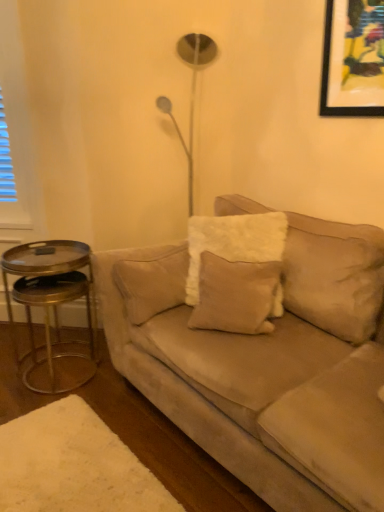
In order to face suede beige couch at center, should I rotate leftwards or rightwards?

A 9.845 degree turn to the right will do.

Locate an element on the screen. suede beige couch at center is located at coordinates (267, 366).

Does gold metallic side table at left lie in front of beige velvet pillow at center?

No, the depth of gold metallic side table at left is greater than that of beige velvet pillow at center.

Is gold metallic side table at left located outside beige velvet pillow at center?

Yes, gold metallic side table at left is outside of beige velvet pillow at center.

From the image's perspective, is gold metallic side table at left below beige velvet pillow at center?

Yes, from the image's perspective, gold metallic side table at left is below beige velvet pillow at center.

From a real-world perspective, is beige velvet pillow at center physically located above or below suede beige couch at center?

In terms of real-world spatial position, beige velvet pillow at center is above suede beige couch at center.

Is beige velvet pillow at center far from suede beige couch at center?

beige velvet pillow at center is near suede beige couch at center, not far away.

Looking at the image, does beige velvet pillow at center seem bigger or smaller compared to suede beige couch at center?

In the image, beige velvet pillow at center appears to be smaller than suede beige couch at center.

Considering the relative positions of beige velvet pillow at center and suede beige couch at center in the image provided, is beige velvet pillow at center to the left of suede beige couch at center from the viewer's perspective?

Yes, beige velvet pillow at center is to the left of suede beige couch at center.

Based on the photo, does beige velvet pillow at center have a lesser width compared to gold metallic side table at left?

Indeed, beige velvet pillow at center has a lesser width compared to gold metallic side table at left.

How much distance is there between beige velvet pillow at center and gold metallic side table at left?

beige velvet pillow at center is 33.95 inches away from gold metallic side table at left.

Is beige velvet pillow at center to the left of gold metallic side table at left from the viewer's perspective?

Incorrect, beige velvet pillow at center is not on the left side of gold metallic side table at left.

Does point (253, 265) appear closer or farther from the camera than point (32, 347)?

Point (253, 265).

Consider the image. Could you tell me if suede beige couch at center is facing gold metallic side table at left?

No, suede beige couch at center is not facing towards gold metallic side table at left.

Is suede beige couch at center far from gold metallic side table at left?

No, suede beige couch at center is not far away from gold metallic side table at left.

Looking at this image, looking at the image, does suede beige couch at center seem bigger or smaller compared to gold metallic side table at left?

Considering their sizes, suede beige couch at center takes up more space than gold metallic side table at left.

Locate an element on the screen. table that appears on the left of suede beige couch at center is located at coordinates (52, 307).

Which object is further away from the camera taking this photo, suede beige couch at center or beige velvet pillow at center?

beige velvet pillow at center is behind.

From the image's perspective, between suede beige couch at center and beige velvet pillow at center, who is located below?

suede beige couch at center appears lower in the image.

Is point (283, 497) more distant than point (222, 265)?

No, (283, 497) is closer to viewer.

Who is bigger, suede beige couch at center or beige velvet pillow at center?

suede beige couch at center is bigger.

Considering the sizes of gold metallic side table at left and suede beige couch at center in the image, is gold metallic side table at left taller or shorter than suede beige couch at center?

In the image, gold metallic side table at left appears to be shorter than suede beige couch at center.

Is gold metallic side table at left positioned in front of suede beige couch at center?

No, gold metallic side table at left is behind suede beige couch at center.

Measure the distance from gold metallic side table at left to suede beige couch at center.

gold metallic side table at left and suede beige couch at center are 27.38 inches apart.

Looking at this image, how many degrees apart are the facing directions of gold metallic side table at left and suede beige couch at center?

They differ by 0.136 degrees in their facing directions.

Identify the location of table that appears below the beige velvet pillow at center (from the image's perspective). Image resolution: width=384 pixels, height=512 pixels. (52, 307).

Locate an element on the screen. This screenshot has width=384, height=512. studio couch located underneath the beige velvet pillow at center (from a real-world perspective) is located at coordinates (267, 366).

Considering their positions, is gold metallic side table at left positioned further to beige velvet pillow at center than suede beige couch at center?

gold metallic side table at left.

Considering their positions, is gold metallic side table at left positioned closer to suede beige couch at center than beige velvet pillow at center?

beige velvet pillow at center is positioned closer to the anchor suede beige couch at center.

From the image, which object appears to be farther from gold metallic side table at left, suede beige couch at center or beige velvet pillow at center?

Based on the image, beige velvet pillow at center appears to be further to gold metallic side table at left.

Considering their positions, is beige velvet pillow at center positioned closer to suede beige couch at center than gold metallic side table at left?

beige velvet pillow at center lies closer to suede beige couch at center than the other object.

Considering their positions, is beige velvet pillow at center positioned closer to gold metallic side table at left than suede beige couch at center?

Among the two, suede beige couch at center is located nearer to gold metallic side table at left.

Estimate the real-world distances between objects in this image. Which object is closer to beige velvet pillow at center, suede beige couch at center or gold metallic side table at left?

The object closer to beige velvet pillow at center is suede beige couch at center.

Find the location of a particular element. This screenshot has width=384, height=512. pillow located between gold metallic side table at left and suede beige couch at center in the left-right direction is located at coordinates (235, 295).